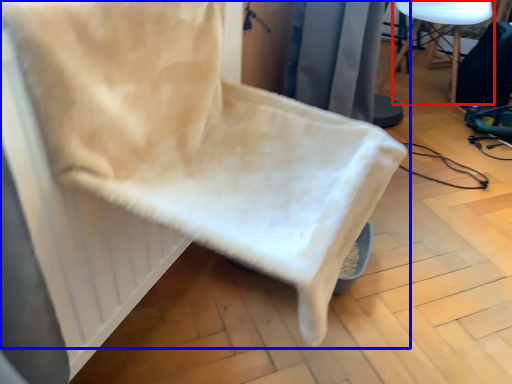
Question: Which of the following is the farthest to the observer, furniture (highlighted by a red box) or chair (highlighted by a blue box)?

Choices:
 (A) furniture
 (B) chair

Answer: (A)